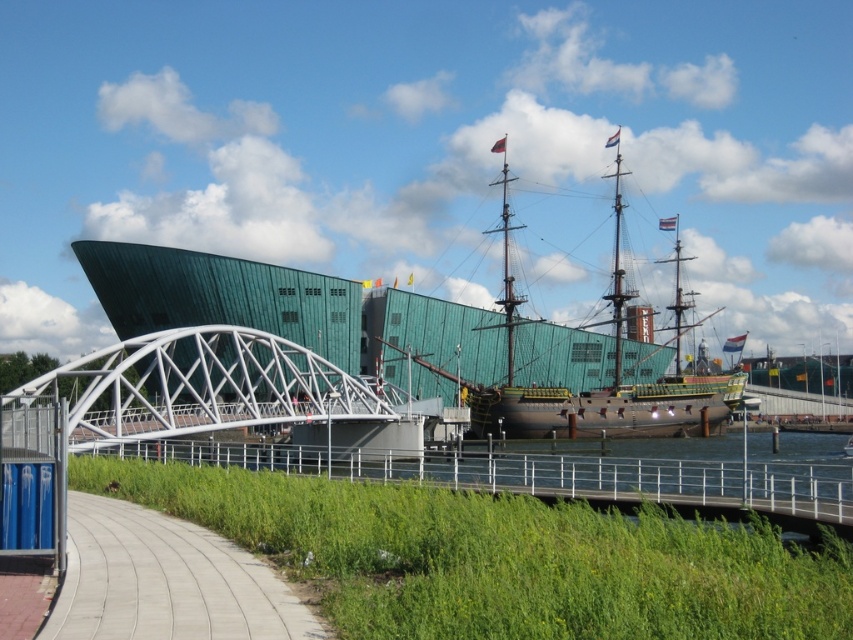
Question: Does concrete sidewalk at lower left appear over brown wooden ship at center?

Choices:
 (A) no
 (B) yes

Answer: (A)

Question: In this image, where is white metallic bridge at center located relative to concrete sidewalk at lower left?

Choices:
 (A) above
 (B) below

Answer: (A)

Question: Among these points, which one is nearest to the camera?

Choices:
 (A) (223, 600)
 (B) (514, 307)
 (C) (251, 392)

Answer: (A)

Question: Among these points, which one is farthest from the camera?

Choices:
 (A) (221, 426)
 (B) (573, 404)

Answer: (B)

Question: Which object is closer to the camera taking this photo?

Choices:
 (A) concrete sidewalk at lower left
 (B) white metallic bridge at center

Answer: (A)

Question: Is the position of concrete sidewalk at lower left more distant than that of brown wooden ship at center?

Choices:
 (A) no
 (B) yes

Answer: (A)